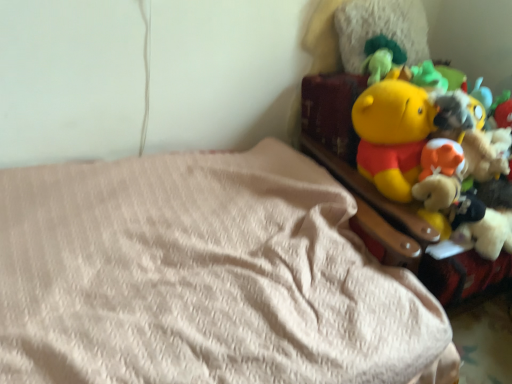
Describe the element at coordinates (203, 277) in the screenshot. This screenshot has height=384, width=512. I see `beige fabric bed at lower left` at that location.

Where is `beige fabric bed at lower left`? This screenshot has height=384, width=512. beige fabric bed at lower left is located at coordinates (203, 277).

Locate an element on the screen. The height and width of the screenshot is (384, 512). yellow plush toy at upper right is located at coordinates (419, 133).

What do you see at coordinates (419, 133) in the screenshot? I see `yellow plush toy at upper right` at bounding box center [419, 133].

The width and height of the screenshot is (512, 384). Find the location of `beige fabric bed at lower left`. beige fabric bed at lower left is located at coordinates (203, 277).

Consider the image. Considering the relative positions of yellow plush toy at upper right and beige fabric bed at lower left in the image provided, is yellow plush toy at upper right to the right of beige fabric bed at lower left from the viewer's perspective?

Yes, yellow plush toy at upper right is to the right of beige fabric bed at lower left.

Relative to beige fabric bed at lower left, is yellow plush toy at upper right in front or behind?

yellow plush toy at upper right is behind beige fabric bed at lower left.

Does point (445, 126) come closer to viewer compared to point (322, 195)?

Yes, point (445, 126) is in front of point (322, 195).

From the image's perspective, between yellow plush toy at upper right and beige fabric bed at lower left, who is located below?

beige fabric bed at lower left is shown below in the image.

From a real-world perspective, which is physically below, yellow plush toy at upper right or beige fabric bed at lower left?

beige fabric bed at lower left is physically lower.

Considering the sizes of objects yellow plush toy at upper right and beige fabric bed at lower left in the image provided, who is wider, yellow plush toy at upper right or beige fabric bed at lower left?

With larger width is beige fabric bed at lower left.

Who is taller, yellow plush toy at upper right or beige fabric bed at lower left?

beige fabric bed at lower left.

Consider the image. Who is bigger, yellow plush toy at upper right or beige fabric bed at lower left?

beige fabric bed at lower left is bigger.

Is yellow plush toy at upper right completely or partially outside of beige fabric bed at lower left?

A: Absolutely, yellow plush toy at upper right is external to beige fabric bed at lower left.

Is yellow plush toy at upper right far from beige fabric bed at lower left?

No, yellow plush toy at upper right is not far away from beige fabric bed at lower left.

Could you tell me if yellow plush toy at upper right is turned towards beige fabric bed at lower left?

No.

How different are the orientations of yellow plush toy at upper right and beige fabric bed at lower left in degrees?

0.000104 degrees separate the facing orientations of yellow plush toy at upper right and beige fabric bed at lower left.

Find the location of `toy on the right of beige fabric bed at lower left`. toy on the right of beige fabric bed at lower left is located at coordinates (419, 133).

Considering the positions of objects beige fabric bed at lower left and yellow plush toy at upper right in the image provided, who is more to the left, beige fabric bed at lower left or yellow plush toy at upper right?

From the viewer's perspective, beige fabric bed at lower left appears more on the left side.

Does beige fabric bed at lower left come in front of yellow plush toy at upper right?

Yes, beige fabric bed at lower left is in front of yellow plush toy at upper right.

Between point (164, 174) and point (377, 143), which one is positioned in front?

The point (377, 143) is closer.

From the image's perspective, who appears lower, beige fabric bed at lower left or yellow plush toy at upper right?

beige fabric bed at lower left.

From a real-world perspective, does beige fabric bed at lower left stand above yellow plush toy at upper right?

No, from a real-world perspective, beige fabric bed at lower left is not on top of yellow plush toy at upper right.

Which object is thinner, beige fabric bed at lower left or yellow plush toy at upper right?

With smaller width is yellow plush toy at upper right.

In terms of height, does beige fabric bed at lower left look taller or shorter compared to yellow plush toy at upper right?

Clearly, beige fabric bed at lower left is taller compared to yellow plush toy at upper right.

Which of these two, beige fabric bed at lower left or yellow plush toy at upper right, is bigger?

With larger size is beige fabric bed at lower left.

Is beige fabric bed at lower left positioned beyond the bounds of yellow plush toy at upper right?

Yes.

Is beige fabric bed at lower left far away from yellow plush toy at upper right?

No, beige fabric bed at lower left is not far away from yellow plush toy at upper right.

Is beige fabric bed at lower left facing towards yellow plush toy at upper right?

No, beige fabric bed at lower left does not turn towards yellow plush toy at upper right.

From the picture: How different are the orientations of beige fabric bed at lower left and yellow plush toy at upper right in degrees?

The facing directions of beige fabric bed at lower left and yellow plush toy at upper right are 0.000104 degrees apart.

Locate an element on the screen. This screenshot has width=512, height=384. toy that is on the right side of beige fabric bed at lower left is located at coordinates (419, 133).

At what (x,y) coordinates should I click in order to perform the action: click on bed in front of the yellow plush toy at upper right. Please return your answer as a coordinate pair (x, y). Looking at the image, I should click on (203, 277).

This screenshot has height=384, width=512. What are the coordinates of `bed that appears on the left of yellow plush toy at upper right` in the screenshot? It's located at (203, 277).